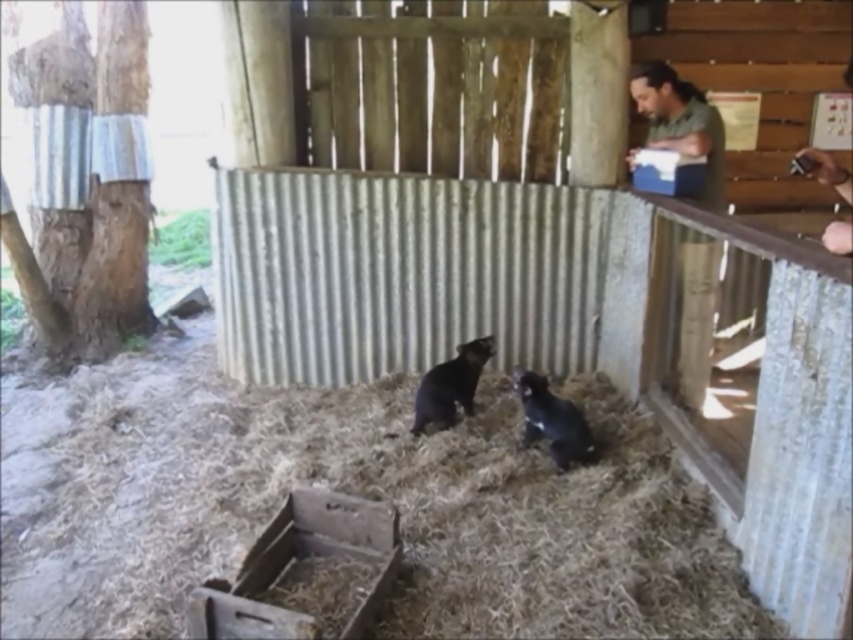
Question: Which object appears farthest from the camera in this image?

Choices:
 (A) shiny black animal at center
 (B) green matte shirt at upper right
 (C) black furry tasmanian devil at center

Answer: (C)

Question: Among these points, which one is farthest from the camera?

Choices:
 (A) (566, 413)
 (B) (424, 413)
 (C) (671, 102)

Answer: (C)

Question: Is green matte shirt at upper right thinner than shiny black animal at center?

Choices:
 (A) no
 (B) yes

Answer: (A)

Question: Which is nearer to the black furry tasmanian devil at center?

Choices:
 (A) shiny black animal at center
 (B) green matte shirt at upper right

Answer: (A)

Question: Is green matte shirt at upper right wider than black furry tasmanian devil at center?

Choices:
 (A) yes
 (B) no

Answer: (A)

Question: Observing the image, what is the correct spatial positioning of green matte shirt at upper right in reference to shiny black animal at center?

Choices:
 (A) right
 (B) left

Answer: (A)